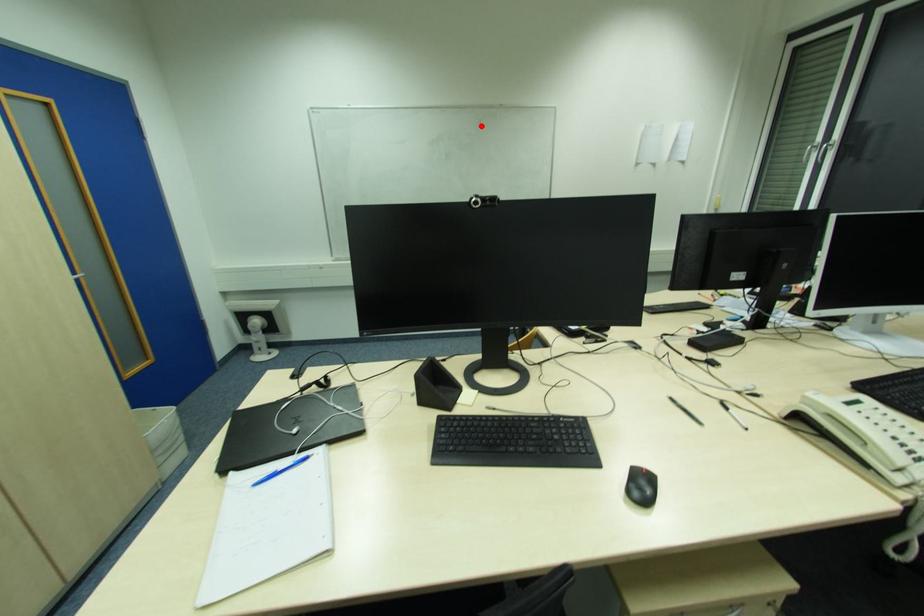
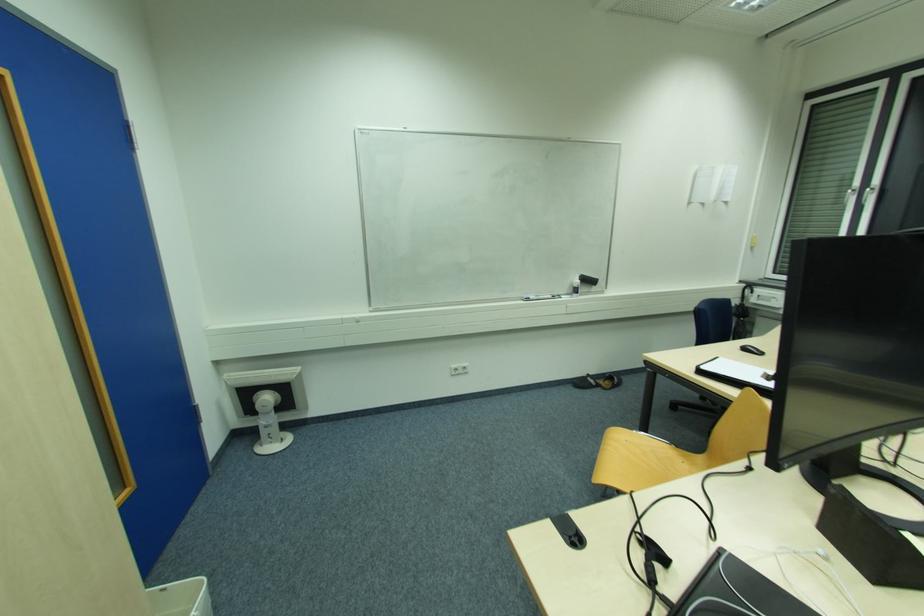
The point at the highlighted location is marked in the first image. Where is the corresponding point in the second image?

(550, 158)